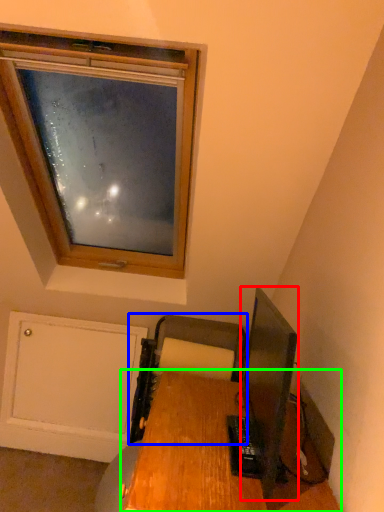
Question: Estimate the real-world distances between objects in this image. Which object is farther from television (highlighted by a red box), printer (highlighted by a blue box) or desk (highlighted by a green box)?

Choices:
 (A) printer
 (B) desk

Answer: (B)